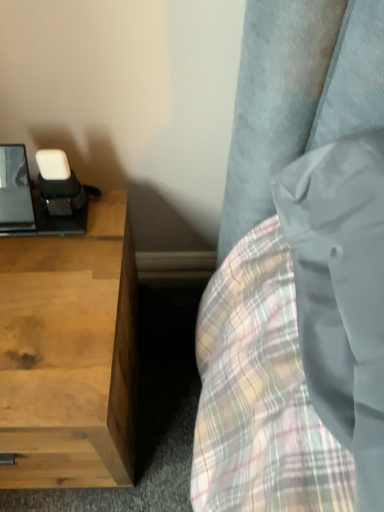
The image size is (384, 512). Describe the element at coordinates (70, 354) in the screenshot. I see `light brown wood desk at left` at that location.

Find the location of a particular element. light brown wood desk at left is located at coordinates (70, 354).

Identify the location of light brown wood desk at left. This screenshot has width=384, height=512. (70, 354).